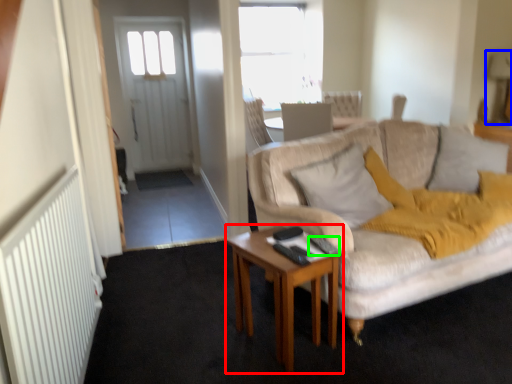
Question: Which object is positioned closest to desk (highlighted by a red box)? Select from lamp (highlighted by a blue box) and remote control (highlighted by a green box).

Choices:
 (A) lamp
 (B) remote control

Answer: (B)